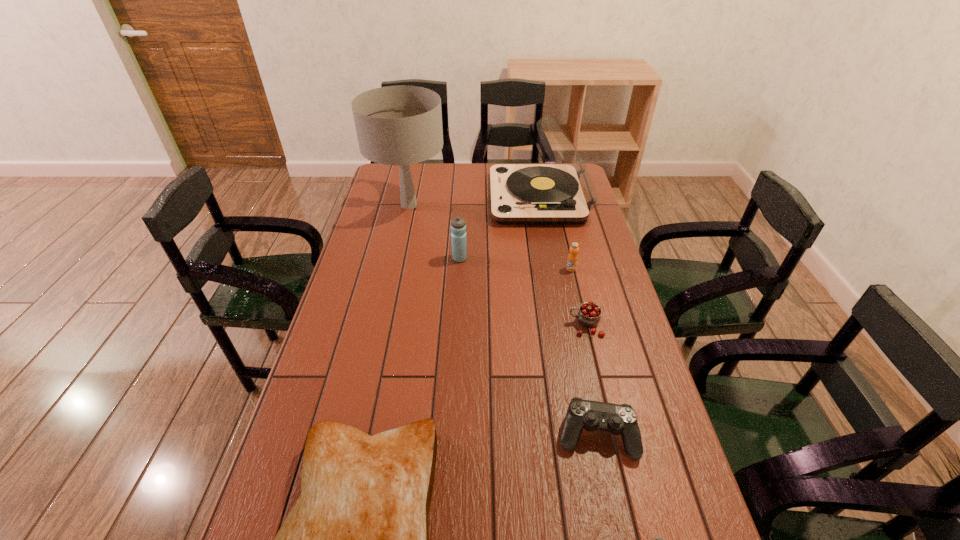
I want to click on vacant space situated with the tonearm facing the front of the record player, so click(445, 198).

Find the location of a particular element. This screenshot has width=960, height=540. vacant space positioned 0.250m on the back of the third tallest object is located at coordinates (462, 214).

Where is `free point located on the front label of the orange juice`? free point located on the front label of the orange juice is located at coordinates point(576,291).

The height and width of the screenshot is (540, 960). I want to click on free point located on the handle side of the fifth farthest object, so pos(507,326).

This screenshot has width=960, height=540. Identify the location of vacant space located on the handle side of the fifth farthest object. 447,326.

You are a GUI agent. You are given a task and a screenshot of the screen. Output one action in this format:
    pyautogui.click(x=<x>, y=<y>)
    Task: Click on the free space located on the handle side of the fifth farthest object
    
    Given the screenshot: What is the action you would take?
    pyautogui.click(x=536, y=326)

At what (x,y) coordinates should I click in order to perform the action: click on free space located on the left of the control. Please return your answer as a coordinate pair (x, y). Looking at the image, I should click on (426, 436).

Where is `lampshade situated at the far edge`? This screenshot has width=960, height=540. lampshade situated at the far edge is located at coordinates (400, 125).

Where is `record player situated at the far edge`? record player situated at the far edge is located at coordinates (562, 192).

Identify the location of object that is at the left edge. The height and width of the screenshot is (540, 960). (400, 125).